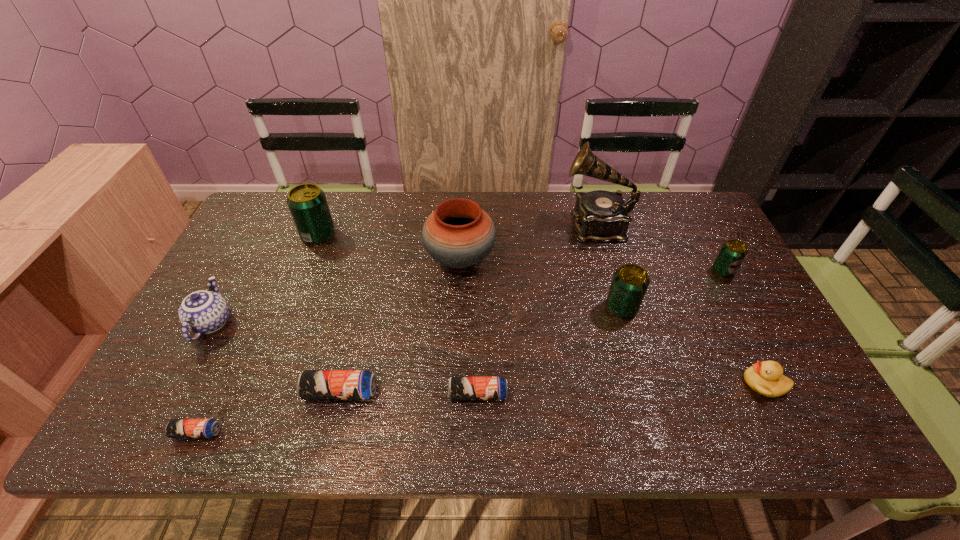
Locate an element on the screen. Image resolution: width=960 pixels, height=540 pixels. vacant space located on the left of the second biggest blue beer can is located at coordinates (281, 394).

Locate an element on the screen. free space located 0.300m on the back of the shortest beer can is located at coordinates (251, 318).

The width and height of the screenshot is (960, 540). What are the coordinates of `phonograph record present at the far edge` in the screenshot? It's located at (601, 216).

The image size is (960, 540). Find the location of `pottery that is at the far edge`. pottery that is at the far edge is located at coordinates tap(458, 234).

You are a GUI agent. You are given a task and a screenshot of the screen. Output one action in this format:
    pyautogui.click(x=<x>, y=<y>)
    Task: Click on the beer can present at the far edge
    
    Given the screenshot: What is the action you would take?
    pyautogui.click(x=307, y=203)

Identify the location of chinaware at the left edge. (203, 312).

Locate an element on the screen. The width and height of the screenshot is (960, 540). beer can that is positioned at the left edge is located at coordinates (176, 428).

This screenshot has height=540, width=960. Identify the location of beer can positioned at the right edge. (732, 253).

Locate an element on the screen. The width and height of the screenshot is (960, 540). duckling positioned at the right edge is located at coordinates (766, 378).

Where is `object located in the near left corner section of the desktop`? object located in the near left corner section of the desktop is located at coordinates (176, 428).